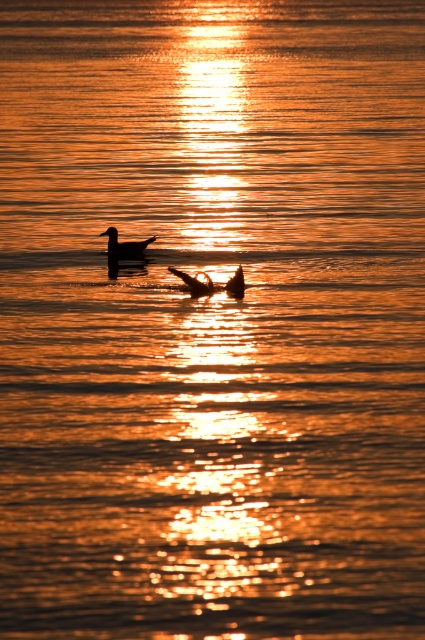
Which is below, silhouette glossy duck at upper center or silhouette feathered duck at center?

Positioned lower is silhouette feathered duck at center.

Which is in front, point (139, 252) or point (180, 276)?

Positioned in front is point (180, 276).

This screenshot has width=425, height=640. I want to click on silhouette glossy duck at upper center, so click(x=124, y=244).